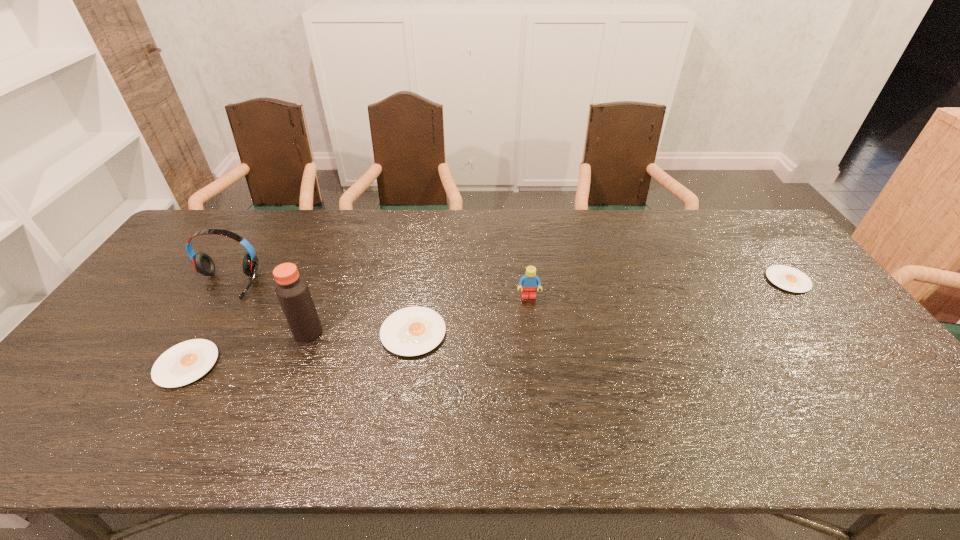
Identify the location of the second shortest object. This screenshot has height=540, width=960. (184, 363).

Locate an element on the screen. the second tallest egg yolk is located at coordinates (184, 363).

What are the coordinates of `the third object from right to left` in the screenshot? It's located at (411, 331).

Identify the location of the rightmost egg yolk. (788, 278).

Locate an element on the screen. the shortest object is located at coordinates (788, 278).

Where is `the second tallest object`? the second tallest object is located at coordinates (202, 262).

This screenshot has width=960, height=540. I want to click on vinegar, so click(x=292, y=291).

Identify the location of the tallest object. (292, 291).

The image size is (960, 540). Identify the location of the fifth object from left to right. (528, 283).

Locate an element on the screen. The image size is (960, 540). Lego is located at coordinates (528, 283).